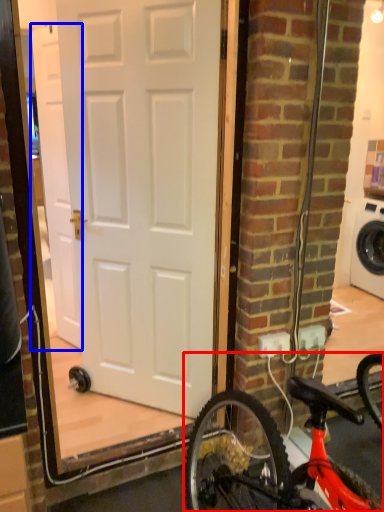
Question: Which point is closer to the camera, bicycle (highlighted by a red box) or door (highlighted by a blue box)?

Choices:
 (A) bicycle
 (B) door

Answer: (A)